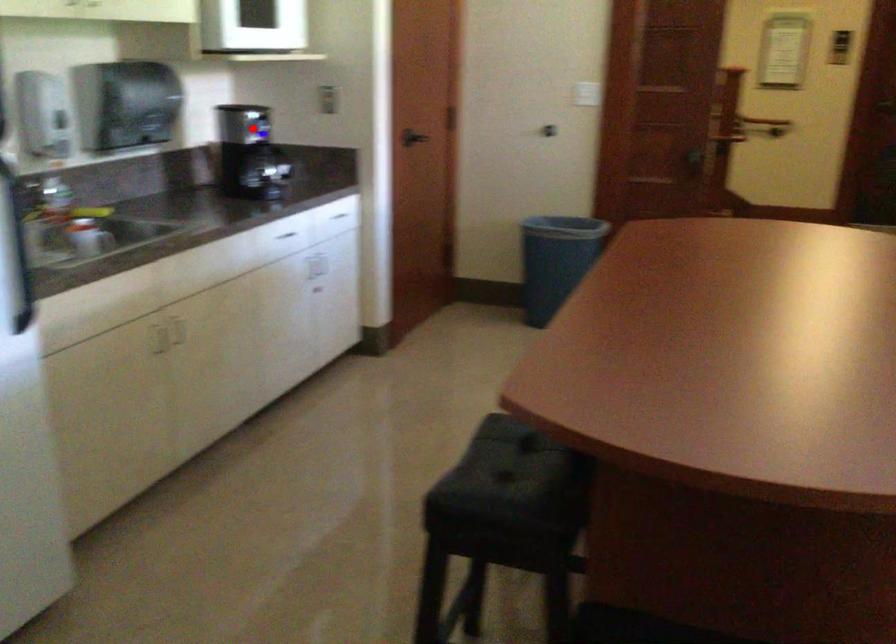
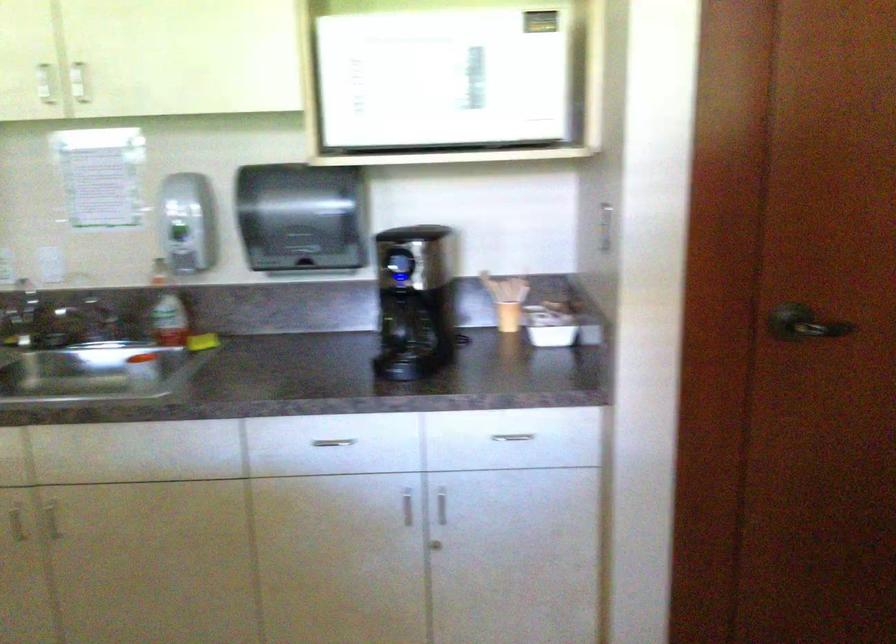
Question: A red point is marked in image1. In image2, is the corresponding 3D point closer to the camera or farther? Reply with the corresponding letter.

Choices:
 (A) The corresponding 3D point is closer.
 (B) The corresponding 3D point is farther.

Answer: (A)